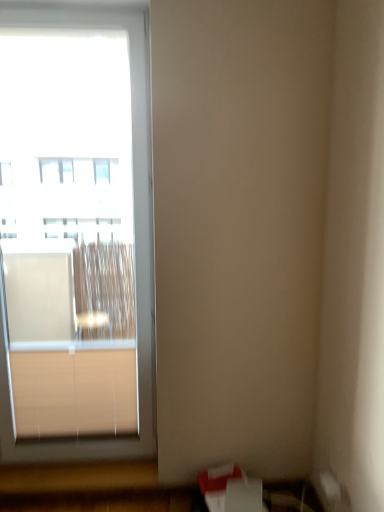
Image resolution: width=384 pixels, height=512 pixels. Find the location of `vacant region under white matte window at upper left (from a real-world perspective)`. vacant region under white matte window at upper left (from a real-world perspective) is located at coordinates (77, 466).